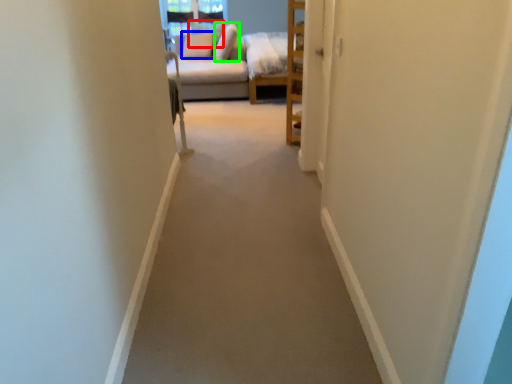
Question: Which object is the closest to the pillow (highlighted by a red box)? Choose among these: pillow (highlighted by a blue box) or pillow (highlighted by a green box).

Choices:
 (A) pillow
 (B) pillow

Answer: (A)